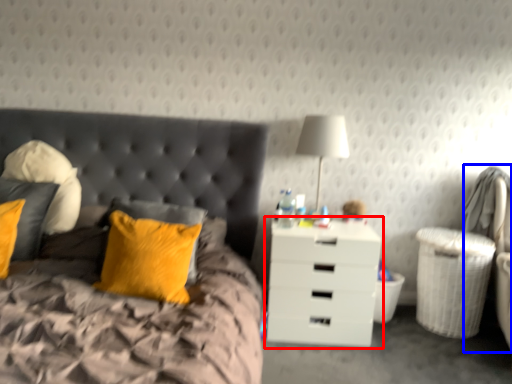
Question: Which object is further to the camera taking this photo, nightstand (highlighted by a red box) or swivel chair (highlighted by a blue box)?

Choices:
 (A) nightstand
 (B) swivel chair

Answer: (A)